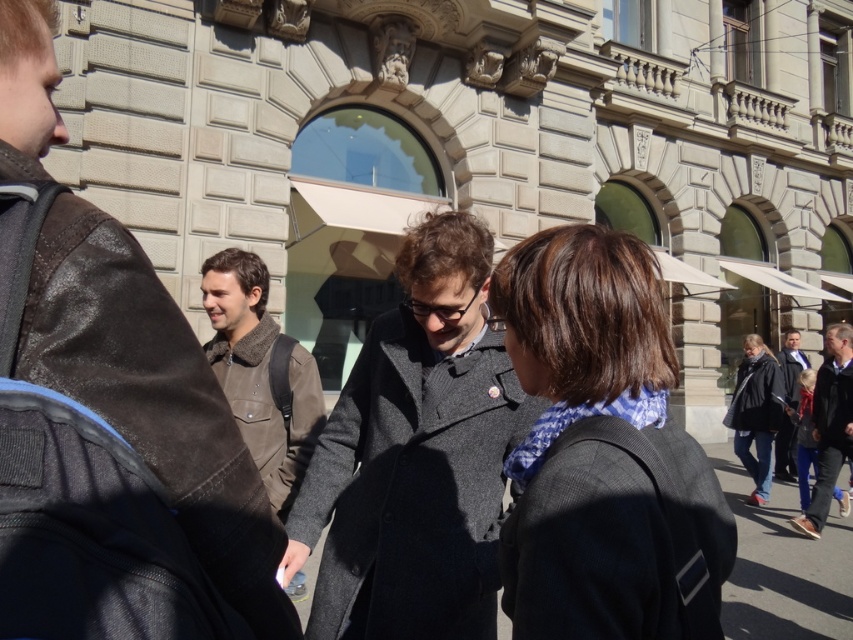
Question: Estimate the real-world distances between objects in this image. Which object is closer to the dark gray wool coat at center?

Choices:
 (A) dark gray coat at right
 (B) dark brown wool coat at center
 (C) brown suede jacket at center-left

Answer: (B)

Question: Does dark gray wool coat at center have a greater width compared to brown suede jacket at center-left?

Choices:
 (A) yes
 (B) no

Answer: (A)

Question: Which point is farther from the camera taking this photo?

Choices:
 (A) (517, 435)
 (B) (28, 92)
 (C) (257, 390)
 (D) (796, 397)

Answer: (D)

Question: Can you confirm if dark brown wool coat at center is bigger than brown suede jacket at center-left?

Choices:
 (A) yes
 (B) no

Answer: (B)

Question: Based on their relative distances, which object is nearer to the brown leather jacket at left?

Choices:
 (A) dark gray wool coat at center
 (B) dark brown wool coat at center
 (C) brown suede jacket at center-left
 (D) dark blue wool coat at right

Answer: (B)

Question: Does dark brown wool coat at center have a larger size compared to dark gray wool coat at center?

Choices:
 (A) yes
 (B) no

Answer: (B)